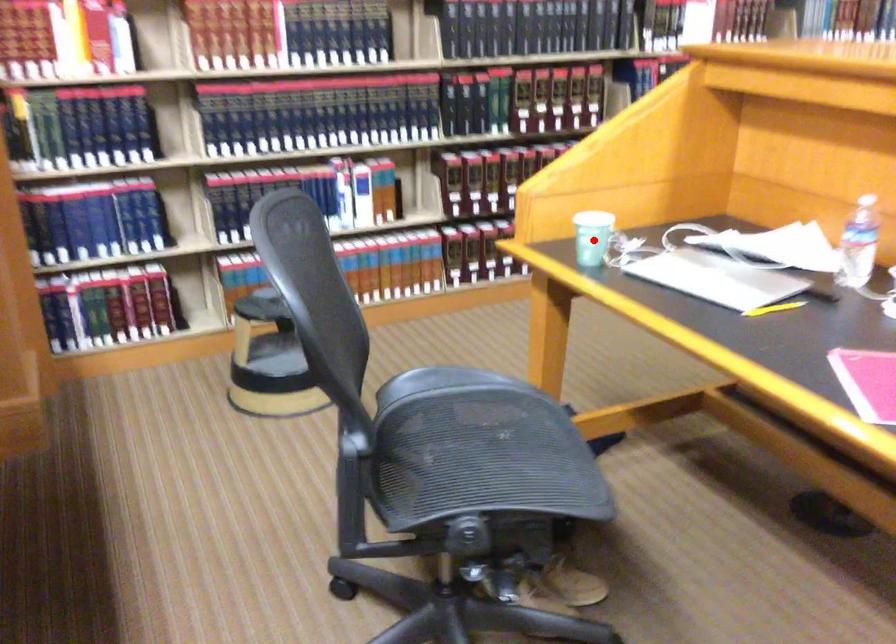
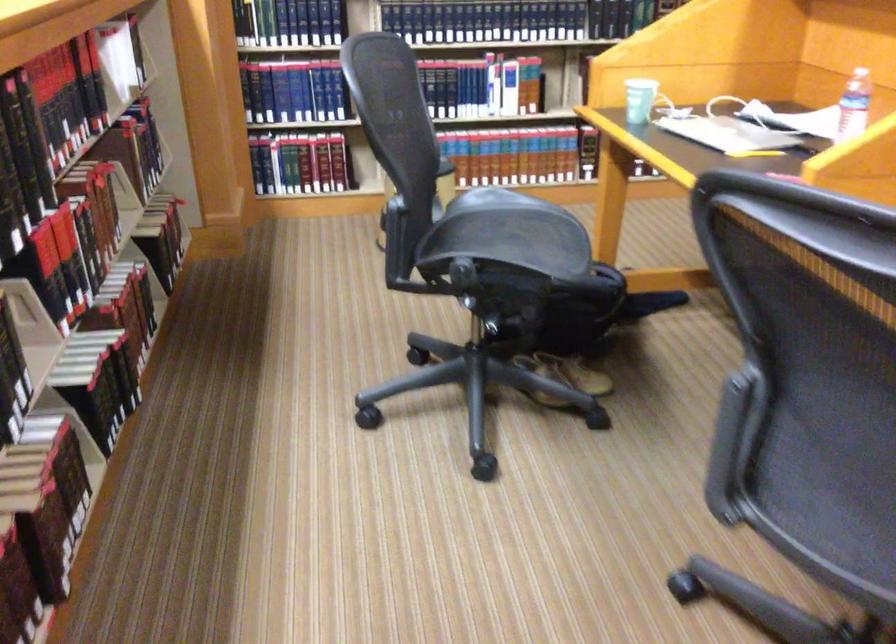
The point at the highlighted location is marked in the first image. Where is the corresponding point in the second image?

(640, 100)